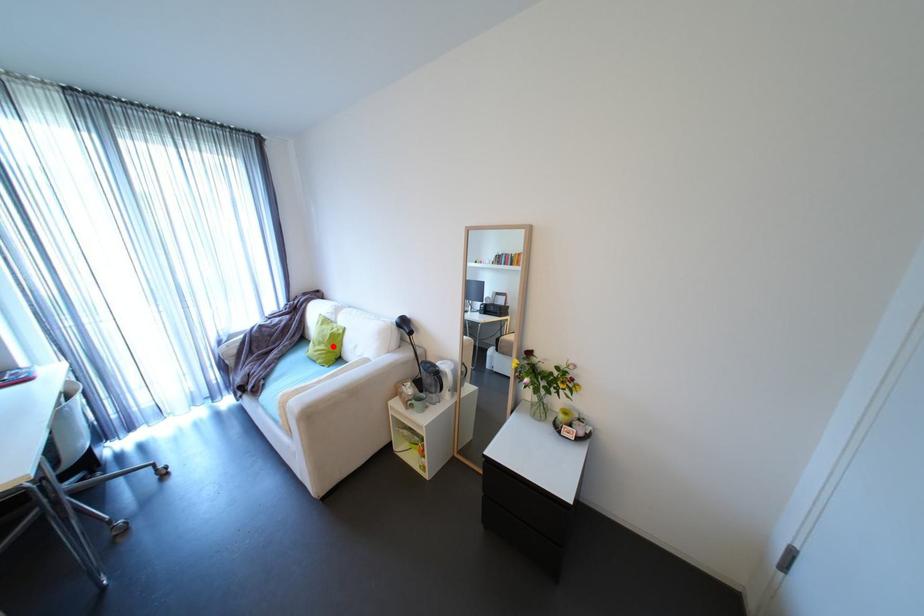
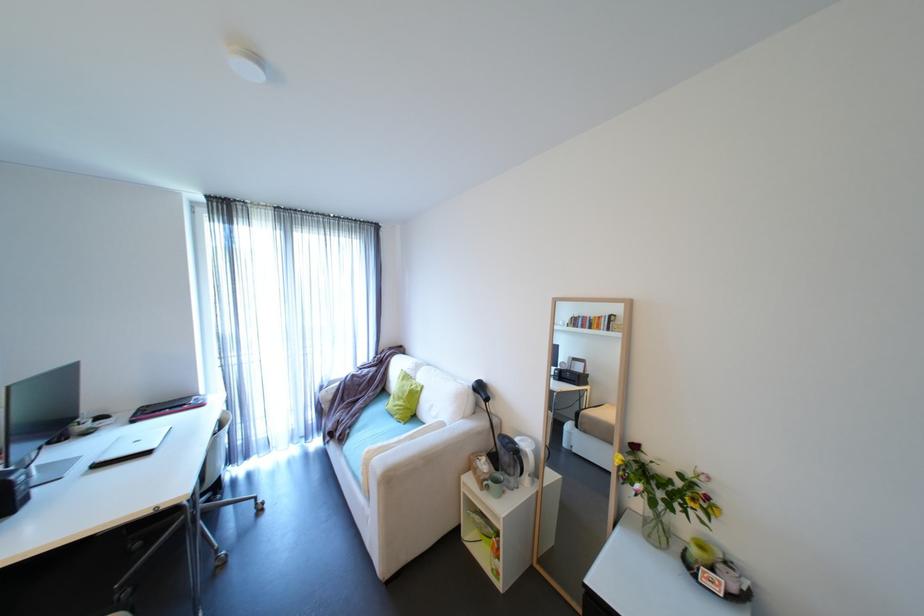
Question: I am providing you with two images of the same scene from different viewpoints. Image1 has a red point marked. In image2, the corresponding 3D location appears at what relative position? Reply with the corresponding letter.

Choices:
 (A) Closer
 (B) Farther

Answer: (B)